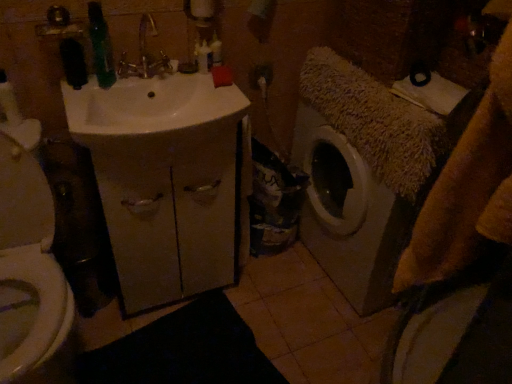
Where is `gold metallic faucet at upper center`? The image size is (512, 384). gold metallic faucet at upper center is located at coordinates (145, 55).

The width and height of the screenshot is (512, 384). What do you see at coordinates (145, 55) in the screenshot?
I see `gold metallic faucet at upper center` at bounding box center [145, 55].

Describe the element at coordinates (170, 213) in the screenshot. I see `white matte cabinet at center` at that location.

Where is `gold metallic faucet at upper center`? The height and width of the screenshot is (384, 512). gold metallic faucet at upper center is located at coordinates (145, 55).

Can you confirm if white matte cabinet at center is smaller than white glossy toilet at left?

Indeed, white matte cabinet at center has a smaller size compared to white glossy toilet at left.

From a real-world perspective, is white matte cabinet at center on top of white glossy toilet at left?

Incorrect, from a real-world perspective, white matte cabinet at center is lower than white glossy toilet at left.

Is point (209, 146) farther from camera compared to point (9, 364)?

Yes, point (209, 146) is behind point (9, 364).

Is translucent plastic bottle at upper center, positioned as the 2th toiletry in left-to-right order, completely or partially outside of white plastic bottle at upper center, which is counted as the first toiletry, starting from the left?

Yes, translucent plastic bottle at upper center, positioned as the 2th toiletry in left-to-right order, is not within white plastic bottle at upper center, which is counted as the first toiletry, starting from the left.

Can you tell me how much translucent plastic bottle at upper center, which is the 1th toiletry in right-to-left order, and white plastic bottle at upper center, which is counted as the first toiletry, starting from the left, differ in facing direction?

They differ by 0.000767 degrees in their facing directions.

In the image, is translucent plastic bottle at upper center, which is the 1th toiletry in right-to-left order, on the left side or the right side of white plastic bottle at upper center, the 2th toiletry when ordered from right to left?

Clearly, translucent plastic bottle at upper center, which is the 1th toiletry in right-to-left order, is on the right of white plastic bottle at upper center, the 2th toiletry when ordered from right to left, in the image.

Which object is closer to the camera taking this photo, translucent plastic bottle at upper center, positioned as the 2th toiletry in left-to-right order, or white plastic bottle at upper center, which is counted as the first toiletry, starting from the left?

white plastic bottle at upper center, which is counted as the first toiletry, starting from the left, is closer to the camera.

This screenshot has width=512, height=384. Identify the location of tap that is in front of the white matte cabinet at center. (145, 55).

Considering the sizes of objects gold metallic faucet at upper center and white matte cabinet at center in the image provided, who is smaller, gold metallic faucet at upper center or white matte cabinet at center?

With smaller size is gold metallic faucet at upper center.

Is gold metallic faucet at upper center turned away from white matte cabinet at center?

No, gold metallic faucet at upper center is not facing away from white matte cabinet at center.

How many degrees apart are the facing directions of white matte cabinet at center and translucent plastic bottle at upper center, which is the 1th toiletry in right-to-left order?

1.54 degrees.

In terms of size, does white matte cabinet at center appear bigger or smaller than translucent plastic bottle at upper center, which is the 1th toiletry in right-to-left order?

In the image, white matte cabinet at center appears to be larger than translucent plastic bottle at upper center, which is the 1th toiletry in right-to-left order.

Is white matte cabinet at center looking in the opposite direction of translucent plastic bottle at upper center, which is the 1th toiletry in right-to-left order?

No, white matte cabinet at center is not facing the opposite direction of translucent plastic bottle at upper center, which is the 1th toiletry in right-to-left order.

From the image's perspective, is white matte cabinet at center above or below translucent plastic bottle at upper center, positioned as the 2th toiletry in left-to-right order?

white matte cabinet at center is below translucent plastic bottle at upper center, positioned as the 2th toiletry in left-to-right order.

Based on their positions, is white glossy toilet at left located to the left or right of gold metallic faucet at upper center?

From the image, it's evident that white glossy toilet at left is to the left of gold metallic faucet at upper center.

From the image's perspective, is white glossy toilet at left on gold metallic faucet at upper center?

No.

Which point is more distant from viewer, (x=42, y=296) or (x=140, y=23)?

The point (x=140, y=23) is more distant.

From a real-world perspective, is white plastic bottle at upper center, which is counted as the first toiletry, starting from the left, positioned over translucent plastic bottle at upper center, which is the 1th toiletry in right-to-left order, based on gravity?

No, from a real-world perspective, white plastic bottle at upper center, which is counted as the first toiletry, starting from the left, is not on top of translucent plastic bottle at upper center, which is the 1th toiletry in right-to-left order.

Consider the image. Is white plastic bottle at upper center, the 2th toiletry when ordered from right to left, surrounding translucent plastic bottle at upper center, positioned as the 2th toiletry in left-to-right order?

No, white plastic bottle at upper center, the 2th toiletry when ordered from right to left, does not contain translucent plastic bottle at upper center, positioned as the 2th toiletry in left-to-right order.

Where is `toiletry in front of the translucent plastic bottle at upper center, which is the 1th toiletry in right-to-left order`? This screenshot has width=512, height=384. toiletry in front of the translucent plastic bottle at upper center, which is the 1th toiletry in right-to-left order is located at coordinates pos(203,57).

Considering the relative sizes of white plastic bottle at upper center, which is counted as the first toiletry, starting from the left, and translucent plastic bottle at upper center, which is the 1th toiletry in right-to-left order, in the image provided, is white plastic bottle at upper center, which is counted as the first toiletry, starting from the left, wider than translucent plastic bottle at upper center, which is the 1th toiletry in right-to-left order,?

Yes.

From the image's perspective, is white glossy toilet at left below translucent plastic bottle at upper center, positioned as the 2th toiletry in left-to-right order?

Yes, from the image's perspective, white glossy toilet at left is below translucent plastic bottle at upper center, positioned as the 2th toiletry in left-to-right order.

Is white glossy toilet at left in front of or behind translucent plastic bottle at upper center, positioned as the 2th toiletry in left-to-right order, in the image?

white glossy toilet at left is positioned closer to the viewer than translucent plastic bottle at upper center, positioned as the 2th toiletry in left-to-right order.

Measure the distance from white glossy toilet at left to translucent plastic bottle at upper center, positioned as the 2th toiletry in left-to-right order.

A distance of 33.78 inches exists between white glossy toilet at left and translucent plastic bottle at upper center, positioned as the 2th toiletry in left-to-right order.

Can translucent plastic bottle at upper center, which is the 1th toiletry in right-to-left order, be found inside white glossy toilet at left?

No, white glossy toilet at left does not contain translucent plastic bottle at upper center, which is the 1th toiletry in right-to-left order.

Locate an element on the screen. drawer behind the white glossy toilet at left is located at coordinates coord(170,213).

I want to click on toiletry below the translucent plastic bottle at upper center, which is the 1th toiletry in right-to-left order (from a real-world perspective), so click(203, 57).

Based on the photo, estimate the real-world distances between objects in this image. Which object is closer to white plastic bottle at upper center, the 2th toiletry when ordered from right to left, translucent plastic bottle at upper center, positioned as the 2th toiletry in left-to-right order, or gold metallic faucet at upper center?

Based on the image, translucent plastic bottle at upper center, positioned as the 2th toiletry in left-to-right order, appears to be nearer to white plastic bottle at upper center, the 2th toiletry when ordered from right to left.

Based on their spatial positions, is white matte cabinet at center or white plastic bottle at upper center, the 2th toiletry when ordered from right to left, closer to white glossy toilet at left?

white matte cabinet at center is positioned closer to the anchor white glossy toilet at left.

When comparing their distances from gold metallic faucet at upper center, does white plastic bottle at upper center, the 2th toiletry when ordered from right to left, or translucent plastic bottle at upper center, positioned as the 2th toiletry in left-to-right order, seem further?

The object further to gold metallic faucet at upper center is translucent plastic bottle at upper center, positioned as the 2th toiletry in left-to-right order.

Which object lies further to the anchor point white plastic bottle at upper center, the 2th toiletry when ordered from right to left, gold metallic faucet at upper center or white matte cabinet at center?

Based on the image, white matte cabinet at center appears to be further to white plastic bottle at upper center, the 2th toiletry when ordered from right to left.

When comparing their distances from translucent plastic bottle at upper center, which is the 1th toiletry in right-to-left order, does white matte cabinet at center or white plastic bottle at upper center, the 2th toiletry when ordered from right to left, seem further?

white matte cabinet at center.

Consider the image. Looking at the image, which one is located closer to white glossy toilet at left, gold metallic faucet at upper center or translucent plastic bottle at upper center, positioned as the 2th toiletry in left-to-right order?

gold metallic faucet at upper center is closer to white glossy toilet at left.

From the image, which object appears to be nearer to translucent plastic bottle at upper center, which is the 1th toiletry in right-to-left order, white glossy toilet at left or white matte cabinet at center?

white matte cabinet at center lies closer to translucent plastic bottle at upper center, which is the 1th toiletry in right-to-left order, than the other object.

From the image, which object appears to be nearer to white glossy toilet at left, gold metallic faucet at upper center or white plastic bottle at upper center, the 2th toiletry when ordered from right to left?

The object closer to white glossy toilet at left is gold metallic faucet at upper center.

Identify the location of drawer between white plastic bottle at upper center, the 2th toiletry when ordered from right to left, and white glossy toilet at left vertically. (170, 213).

This screenshot has height=384, width=512. I want to click on tap between white plastic bottle at upper center, the 2th toiletry when ordered from right to left, and white glossy toilet at left vertically, so click(145, 55).

The width and height of the screenshot is (512, 384). Find the location of `toiletry between translucent plastic bottle at upper center, positioned as the 2th toiletry in left-to-right order, and white glossy toilet at left from top to bottom`. toiletry between translucent plastic bottle at upper center, positioned as the 2th toiletry in left-to-right order, and white glossy toilet at left from top to bottom is located at coordinates (203, 57).

What are the coordinates of `drawer between gold metallic faucet at upper center and white glossy toilet at left from top to bottom` in the screenshot? It's located at (170, 213).